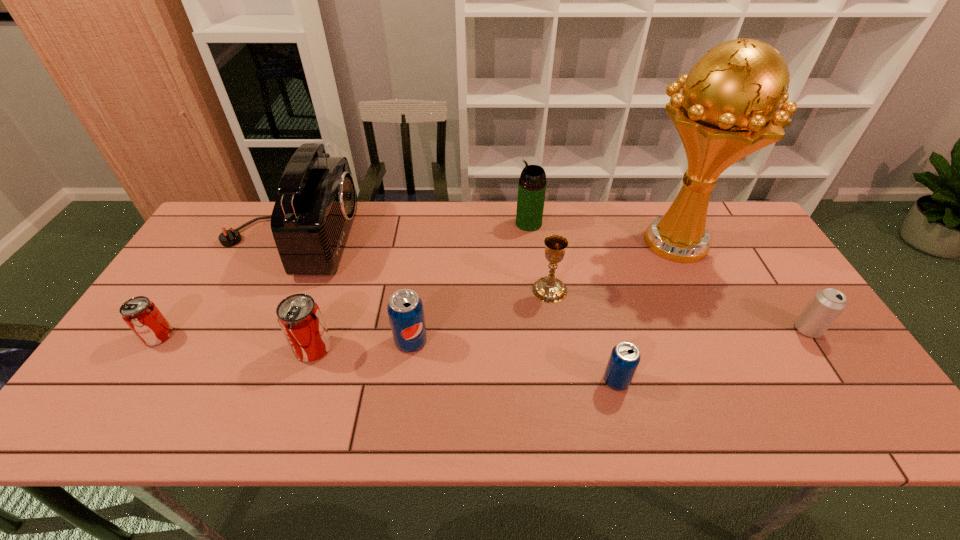
Find the location of `free spot located from the spout of the thermos bottle`. free spot located from the spout of the thermos bottle is located at coordinates (433, 224).

Where is `free space located 0.210m from the spout of the thermos bottle`? free space located 0.210m from the spout of the thermos bottle is located at coordinates (451, 224).

Identify the location of vacant region located from the spout of the thermos bottle. The width and height of the screenshot is (960, 540). (430, 224).

This screenshot has height=540, width=960. What are the coordinates of `vacant space situated on the back of the chalice` in the screenshot? It's located at (541, 235).

You are a GUI agent. You are given a task and a screenshot of the screen. Output one action in this format:
    pyautogui.click(x=<x>, y=<y>)
    Task: Click on the vacant space located 0.070m on the front of the left blue pop soda
    This screenshot has width=960, height=540.
    Given the screenshot: What is the action you would take?
    pyautogui.click(x=406, y=380)

Where is `vacant space located on the back of the second pop soda from left to right`? vacant space located on the back of the second pop soda from left to right is located at coordinates (333, 288).

Where is `vacant region located on the back of the rightmost object`? vacant region located on the back of the rightmost object is located at coordinates (743, 233).

Locate an element on the screen. This screenshot has width=960, height=540. free spot located 0.070m on the back of the left red pop soda is located at coordinates (179, 305).

Where is `free point located 0.290m on the back of the rightmost pop soda`? Image resolution: width=960 pixels, height=540 pixels. free point located 0.290m on the back of the rightmost pop soda is located at coordinates (592, 282).

Identify the location of trophy_cup that is at the far edge. (x=727, y=109).